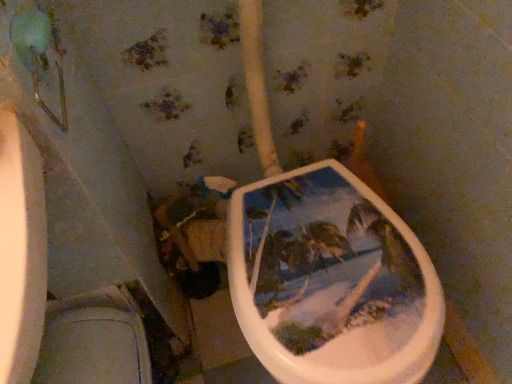
In order to click on white glossy toilet at lower left in this screenshot , I will do `click(94, 348)`.

In order to face white glossy toilet at lower left, should I rotate leftwards or rightwards?

Rotate left and turn 18.479 degrees.

Image resolution: width=512 pixels, height=384 pixels. Describe the element at coordinates (94, 348) in the screenshot. I see `white glossy toilet at lower left` at that location.

Where is `white glossy toilet at lower left`? white glossy toilet at lower left is located at coordinates (94, 348).